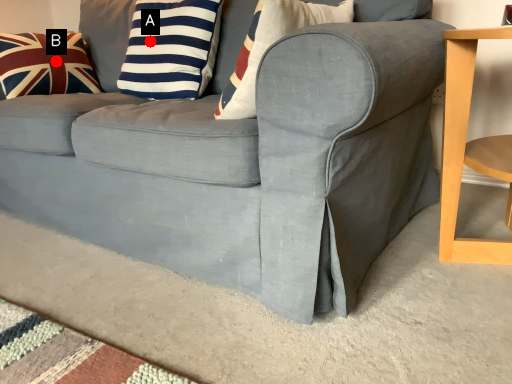
Question: Two points are circled on the image, labeled by A and B beside each circle. Which point appears farthest from the camera in this image?

Choices:
 (A) A is further
 (B) B is further

Answer: (B)